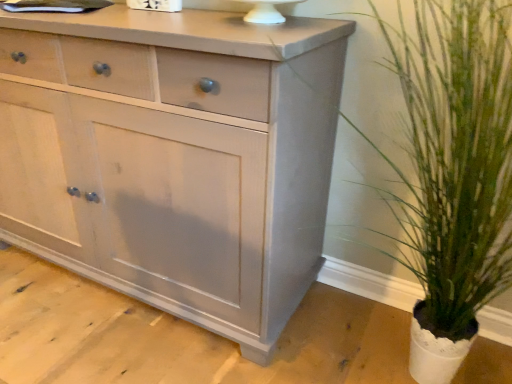
Question: Considering the relative sizes of green leafy plant at right and matte gray cabinet at center in the image provided, is green leafy plant at right taller than matte gray cabinet at center?

Choices:
 (A) no
 (B) yes

Answer: (A)

Question: Considering the relative sizes of green leafy plant at right and matte gray cabinet at center in the image provided, is green leafy plant at right thinner than matte gray cabinet at center?

Choices:
 (A) no
 (B) yes

Answer: (A)

Question: Is green leafy plant at right outside matte gray cabinet at center?

Choices:
 (A) yes
 (B) no

Answer: (A)

Question: Is green leafy plant at right far from matte gray cabinet at center?

Choices:
 (A) yes
 (B) no

Answer: (B)

Question: Considering the relative sizes of green leafy plant at right and matte gray cabinet at center in the image provided, is green leafy plant at right wider than matte gray cabinet at center?

Choices:
 (A) no
 (B) yes

Answer: (B)

Question: From a real-world perspective, is green leafy plant at right positioned under matte gray cabinet at center based on gravity?

Choices:
 (A) no
 (B) yes

Answer: (A)

Question: From the image's perspective, is matte gray cabinet at center over green leafy plant at right?

Choices:
 (A) yes
 (B) no

Answer: (A)

Question: Considering the relative positions of matte gray cabinet at center and green leafy plant at right in the image provided, is matte gray cabinet at center in front of green leafy plant at right?

Choices:
 (A) yes
 (B) no

Answer: (B)

Question: Can you confirm if matte gray cabinet at center is smaller than green leafy plant at right?

Choices:
 (A) yes
 (B) no

Answer: (B)

Question: Considering the relative positions of matte gray cabinet at center and green leafy plant at right in the image provided, is matte gray cabinet at center to the right of green leafy plant at right from the viewer's perspective?

Choices:
 (A) yes
 (B) no

Answer: (B)

Question: Is the surface of matte gray cabinet at center in direct contact with green leafy plant at right?

Choices:
 (A) no
 (B) yes

Answer: (A)

Question: From a real-world perspective, is matte gray cabinet at center beneath green leafy plant at right?

Choices:
 (A) yes
 (B) no

Answer: (A)

Question: Relative to green leafy plant at right, is matte gray cabinet at center in front or behind?

Choices:
 (A) behind
 (B) front

Answer: (A)